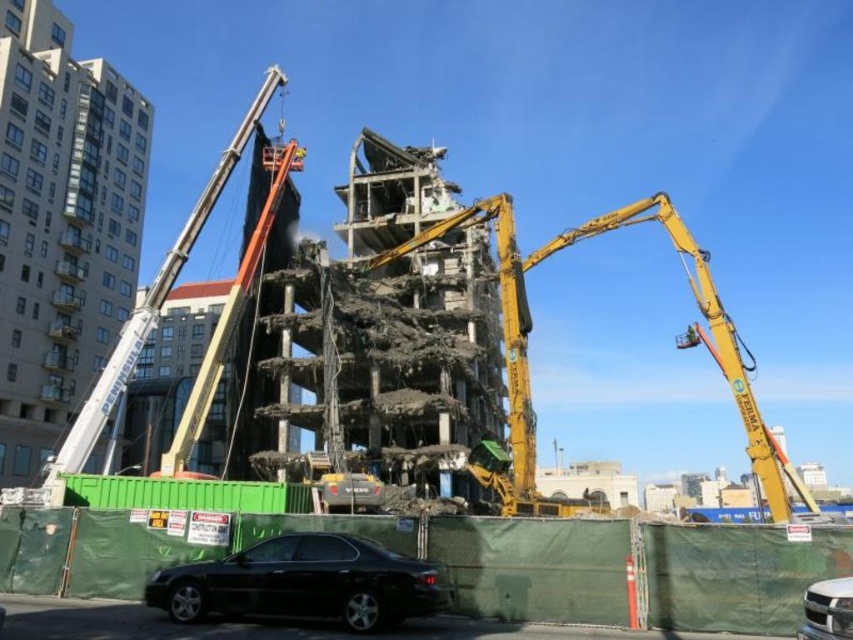
Looking at this image, does matte black sedan at lower left have a lesser height compared to white metal crane at upper left?

Indeed, matte black sedan at lower left has a lesser height compared to white metal crane at upper left.

Can you confirm if matte black sedan at lower left is smaller than white metal crane at upper left?

Yes, matte black sedan at lower left is smaller than white metal crane at upper left.

Who is more forward, [300,572] or [97,406]?

Point [300,572] is more forward.

At what (x,y) coordinates should I click in order to perform the action: click on matte black sedan at lower left. Please return your answer as a coordinate pair (x, y). Looking at the image, I should click on (303, 582).

Is point (515, 378) positioned in front of point (312, 557)?

No, it is behind (312, 557).

Is point (648, 208) less distant than point (306, 547)?

No, it is behind (306, 547).

The image size is (853, 640). I want to click on yellow metallic arm at center, so click(x=527, y=362).

Is point (229, 154) positioned in front of point (846, 618)?

No, (229, 154) is behind (846, 618).

The width and height of the screenshot is (853, 640). What do you see at coordinates (144, 314) in the screenshot?
I see `white metal crane at upper left` at bounding box center [144, 314].

Image resolution: width=853 pixels, height=640 pixels. I want to click on white metal crane at upper left, so click(x=144, y=314).